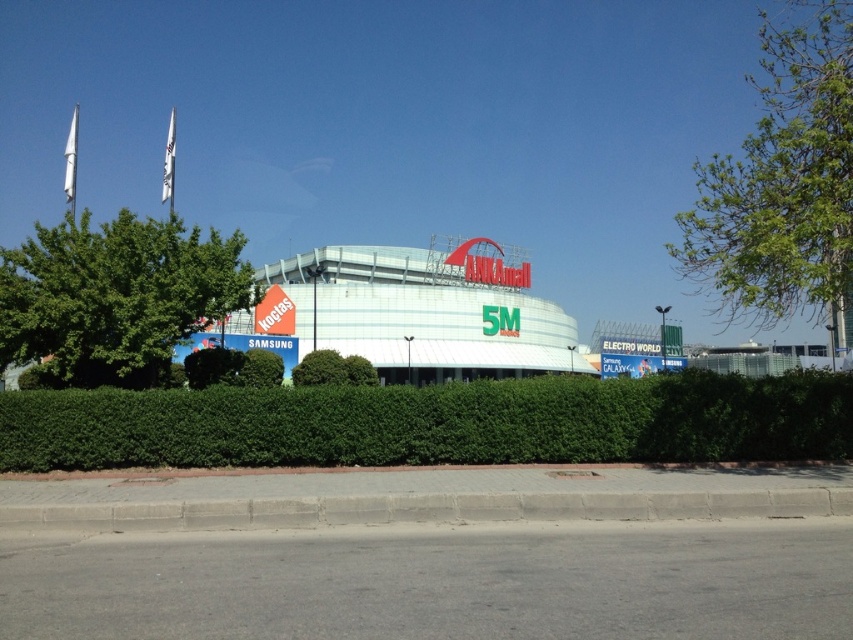
Who is higher up, green leafy hedge at center or green leafy tree at right?

Positioned higher is green leafy tree at right.

Does green leafy hedge at center appear on the left side of green leafy tree at right?

Yes, green leafy hedge at center is to the left of green leafy tree at right.

You are a GUI agent. You are given a task and a screenshot of the screen. Output one action in this format:
    pyautogui.click(x=<x>, y=<y>)
    Task: Click on the green leafy hedge at center
    Image resolution: width=853 pixels, height=640 pixels.
    Given the screenshot: What is the action you would take?
    pyautogui.click(x=434, y=422)

Does white glossy stadium at center have a larger size compared to green leafy tree at left?

Incorrect, white glossy stadium at center is not larger than green leafy tree at left.

Does white glossy stadium at center appear under green leafy tree at left?

Yes.

Locate an element on the screen. The width and height of the screenshot is (853, 640). white glossy stadium at center is located at coordinates (415, 314).

Between green leafy hedge at center and white glossy stadium at center, which one has less height?

green leafy hedge at center

Between point (796, 406) and point (476, 288), which one is positioned behind?

The point (476, 288) is more distant.

At what (x,y) coordinates should I click in order to perform the action: click on green leafy hedge at center. Please return your answer as a coordinate pair (x, y). The width and height of the screenshot is (853, 640). Looking at the image, I should click on [x=434, y=422].